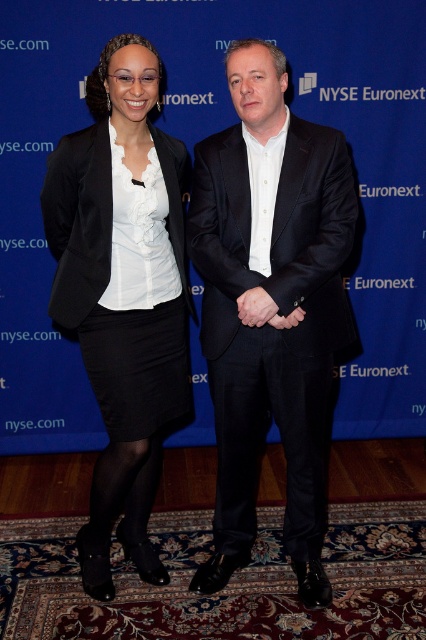
Question: Which of the following is the farthest from the observer?

Choices:
 (A) matte black skirt at left
 (B) matte black hand at center

Answer: (A)

Question: Estimate the real-world distances between objects in this image. Which object is farther from the matte black skirt at left?

Choices:
 (A) matte black hand at center
 (B) black matte suit at center

Answer: (A)

Question: Is black matte suit at center above matte black skirt at left?

Choices:
 (A) no
 (B) yes

Answer: (A)

Question: Which point is farther from the camera taking this photo?

Choices:
 (A) (120, 355)
 (B) (287, 212)

Answer: (A)

Question: Is black matte suit at center to the right of matte black hand at center from the viewer's perspective?

Choices:
 (A) yes
 (B) no

Answer: (A)

Question: Considering the relative positions of black matte suit at center and matte black skirt at left in the image provided, where is black matte suit at center located with respect to matte black skirt at left?

Choices:
 (A) right
 (B) left

Answer: (A)